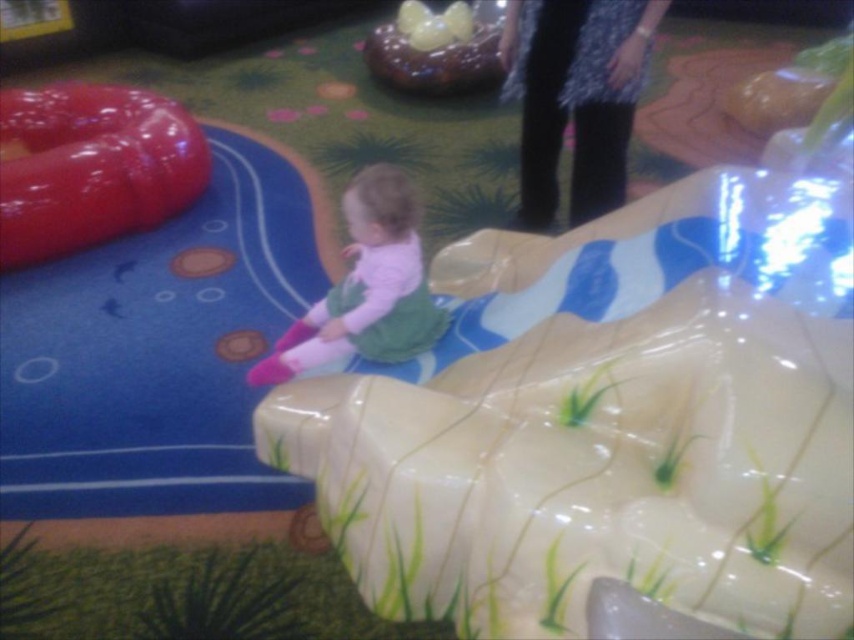
You are a parent trying to ensure your child stays safe while playing. You notice the glossy plastic slide at left and the shiny chocolate cake at upper center. Which object is positioned higher in the image?

The shiny chocolate cake at upper center is positioned higher than the glossy plastic slide at left.

From the picture: You are a parent trying to decide where to place a new toy. The pink fabric toddler at center is currently sitting on the inflatable structure. The shiny chocolate cake at upper center is on a table. If the toy is 1.2 meters wide, can it fit between them?

The pink fabric toddler at center is narrower than the shiny chocolate cake at upper center. Since the toy is 1.2 meters wide, it depends on the actual width of the space between them. However, since the toddler is narrower, there might be enough space if the cake is wider. But without exact measurements, we can only say the cake is wider than the toddler.